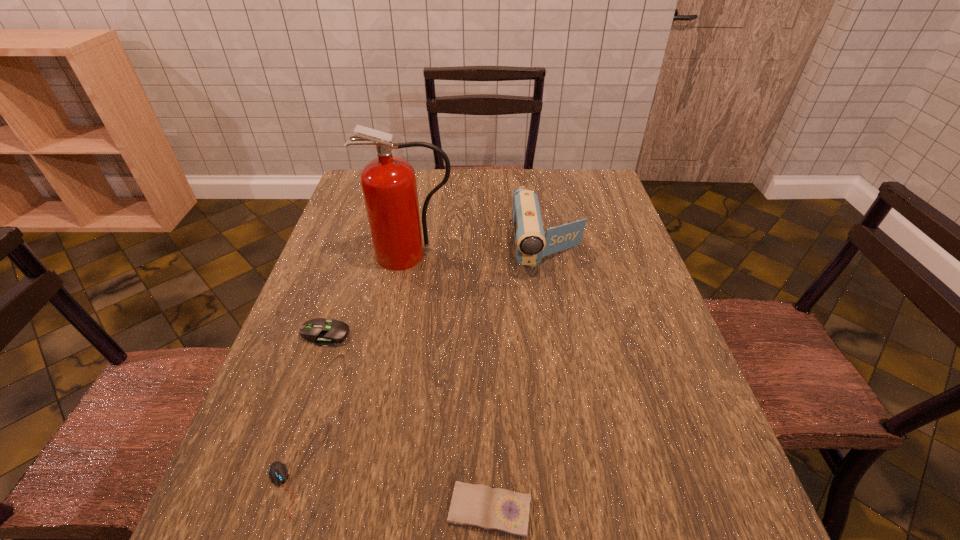
Locate an element on the screen. The image size is (960, 540). vacant area that lies between the tallest object and the third farthest object is located at coordinates pyautogui.click(x=369, y=295).

Locate which object is the fourth closest to the second tallest object. Please provide its 2D coordinates. Your answer should be formatted as a tuple, i.e. [(x, y)], where the tuple contains the x and y coordinates of a point satisfying the conditions above.

[(278, 471)]

Where is `the second closest object to the fire extinguisher`? Image resolution: width=960 pixels, height=540 pixels. the second closest object to the fire extinguisher is located at coordinates (323, 333).

Locate an element on the screen. Image resolution: width=960 pixels, height=540 pixels. vacant region that satisfies the following two spatial constraints: 1. with the handle and nozzle on the diary; 2. on the left side of the tallest object is located at coordinates (365, 510).